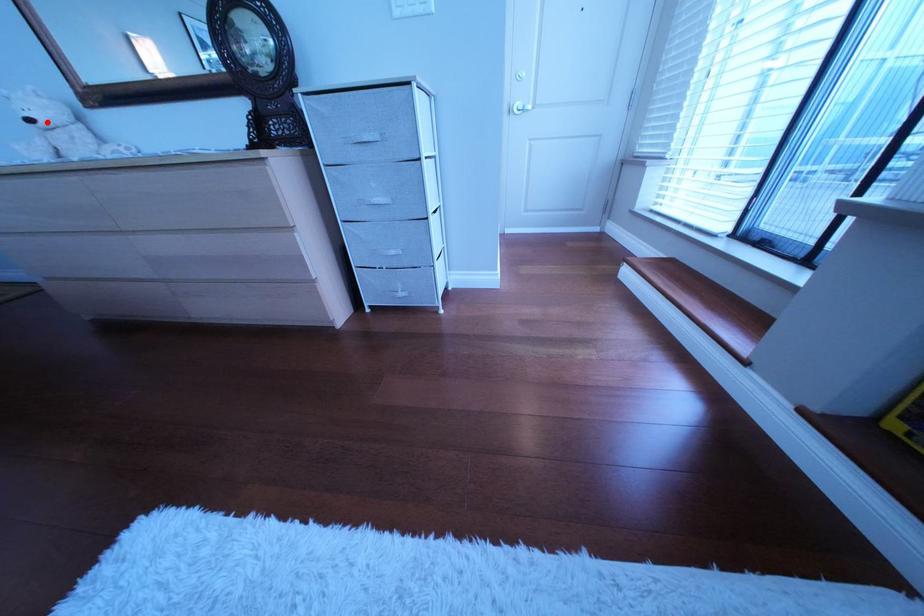
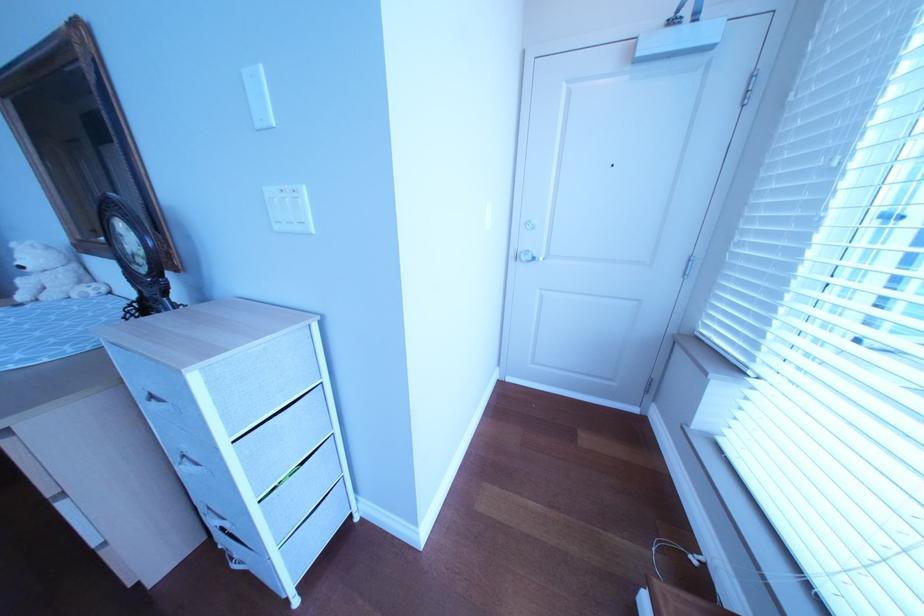
Question: I am providing you with two images of the same scene from different viewpoints. A red point is shown in image1. For the corresponding object point in image2, is it positioned nearer or farther from the camera?

Choices:
 (A) Nearer
 (B) Farther

Answer: (A)